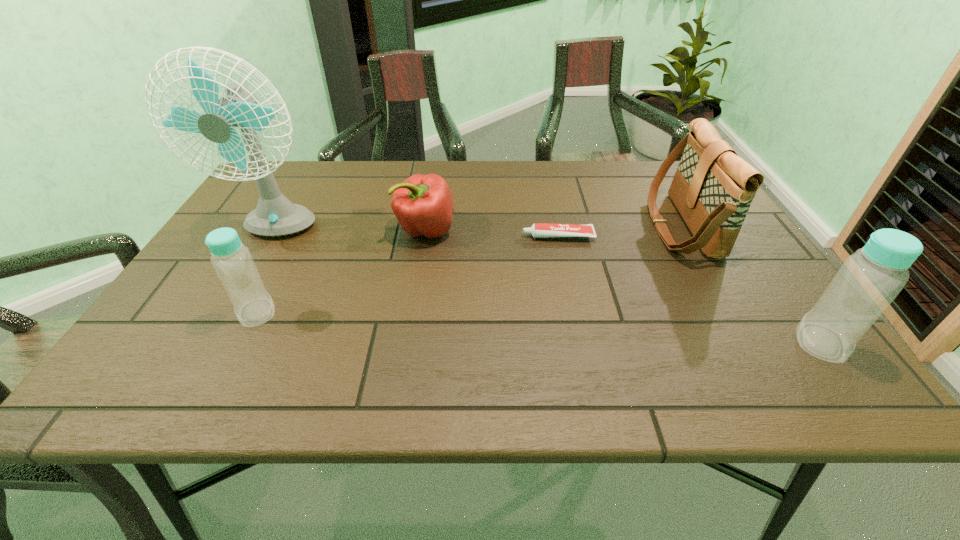
You are a GUI agent. You are given a task and a screenshot of the screen. Output one action in this format:
    pyautogui.click(x=<x>, y=<y>)
    Task: Click on the left bottle
    
    Given the screenshot: What is the action you would take?
    pyautogui.click(x=232, y=261)

Image resolution: width=960 pixels, height=540 pixels. Identify the location of the shorter bottle. (232, 261).

The image size is (960, 540). Identify the location of the rightmost object. (869, 280).

At what (x,y) coordinates should I click in order to perform the action: click on the right bottle. Please return your answer as a coordinate pair (x, y). This screenshot has height=540, width=960. Looking at the image, I should click on (869, 280).

I want to click on shoulder bag, so click(x=713, y=188).

Find the location of a particular element. the second shortest object is located at coordinates (423, 204).

At what (x,y) coordinates should I click in order to perform the action: click on bell pepper. Please return your answer as a coordinate pair (x, y). The height and width of the screenshot is (540, 960). Looking at the image, I should click on (423, 204).

The width and height of the screenshot is (960, 540). What are the coordinates of `the tallest object` in the screenshot? It's located at (275, 215).

Find the location of a particular element. toothpaste is located at coordinates (538, 230).

Identify the location of the third object from right to left. Image resolution: width=960 pixels, height=540 pixels. (538, 230).